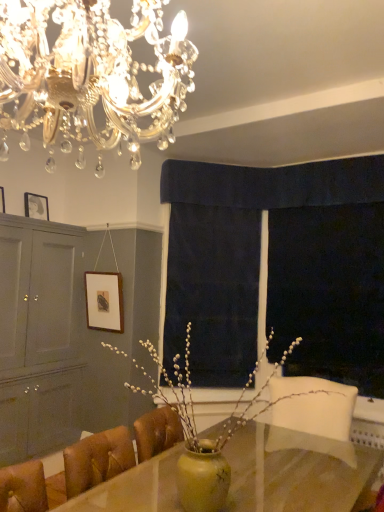
Question: Is wooden picture frame at upper left, acting as the 1th picture frame starting from the top, further to the viewer compared to dark blue velvet curtain at center, the second curtain positioned from the right?

Choices:
 (A) no
 (B) yes

Answer: (A)

Question: Can you confirm if wooden picture frame at upper left, positioned as the 1th picture frame in left-to-right order, is smaller than dark blue velvet curtain at center, the 1th curtain from the left?

Choices:
 (A) yes
 (B) no

Answer: (A)

Question: From the image's perspective, does wooden picture frame at upper left, acting as the 1th picture frame starting from the top, appear lower than dark blue velvet curtain at center, the 2th curtain from the top?

Choices:
 (A) no
 (B) yes

Answer: (A)

Question: Could you tell me if wooden picture frame at upper left, acting as the 1th picture frame starting from the top, is turned towards dark blue velvet curtain at center, the 2th curtain from the top?

Choices:
 (A) yes
 (B) no

Answer: (B)

Question: From a real-world perspective, does wooden picture frame at upper left, positioned as the 1th picture frame in left-to-right order, sit lower than dark blue velvet curtain at center, the 2th curtain from the top?

Choices:
 (A) yes
 (B) no

Answer: (B)

Question: Is transparent plastic screen at right to the left or to the right of wooden picture frame at upper left, the first picture frame viewed from the right, in the image?

Choices:
 (A) left
 (B) right

Answer: (B)

Question: From the image's perspective, is transparent plastic screen at right positioned above or below wooden picture frame at upper left, the third picture frame in the left-to-right sequence?

Choices:
 (A) below
 (B) above

Answer: (A)

Question: Considering their positions, is transparent plastic screen at right located in front of or behind wooden picture frame at upper left, acting as the 1th picture frame starting from the bottom?

Choices:
 (A) front
 (B) behind

Answer: (A)

Question: From a real-world perspective, is transparent plastic screen at right above or below wooden picture frame at upper left, acting as the 1th picture frame starting from the bottom?

Choices:
 (A) above
 (B) below

Answer: (A)

Question: From the image's perspective, is wooden picture frame at upper left, the 3th picture frame in the right-to-left sequence, above or below matte gray cabinet at left?

Choices:
 (A) below
 (B) above

Answer: (B)

Question: Considering the positions of point (3, 211) and point (11, 346), is point (3, 211) closer or farther from the camera than point (11, 346)?

Choices:
 (A) farther
 (B) closer

Answer: (A)

Question: Looking at their shapes, would you say wooden picture frame at upper left, acting as the 1th picture frame starting from the top, is wider or thinner than matte gray cabinet at left?

Choices:
 (A) thin
 (B) wide

Answer: (A)

Question: Considering the positions of wooden picture frame at upper left, positioned as the 1th picture frame in left-to-right order, and matte gray cabinet at left in the image, is wooden picture frame at upper left, positioned as the 1th picture frame in left-to-right order, bigger or smaller than matte gray cabinet at left?

Choices:
 (A) big
 (B) small

Answer: (B)

Question: Considering their positions, is yellow matte vase at center located in front of or behind crystal chandelier at upper center?

Choices:
 (A) front
 (B) behind

Answer: (B)

Question: In terms of size, does yellow matte vase at center appear bigger or smaller than crystal chandelier at upper center?

Choices:
 (A) big
 (B) small

Answer: (B)